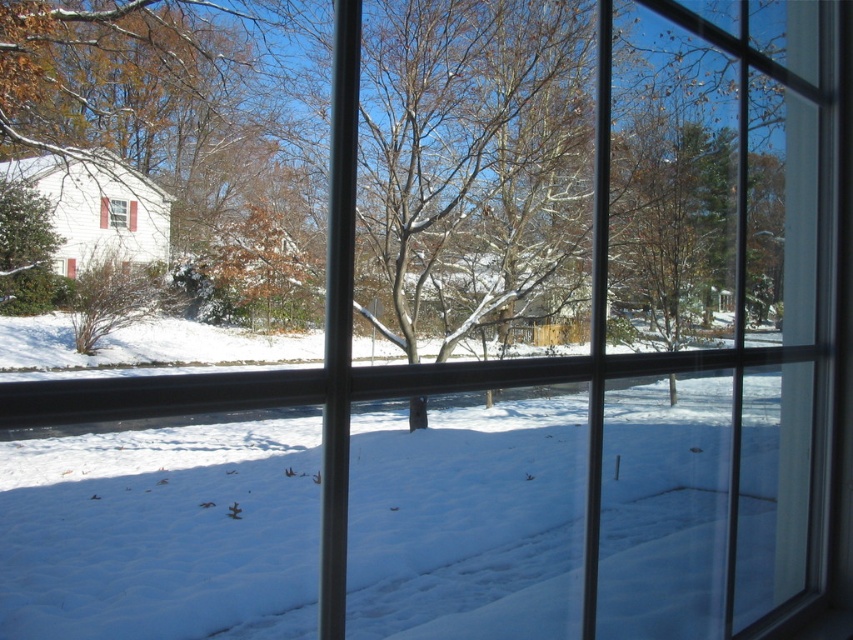
You are an interior designer assessing the natural light in a room. You notice the matte white window at upper left and the clear glass window at center. Which window allows more light into the room?

The clear glass window at center allows more light into the room because it is made of clear glass, which is more transparent than the matte white window at upper left.

You are looking through the window at the winter scene. There are two points marked in the image. The first point is at coordinates point (103,212) and the second is at point (125,211). Which point is closer to you?

Point (103,212) is closer to the camera than point (125,211).